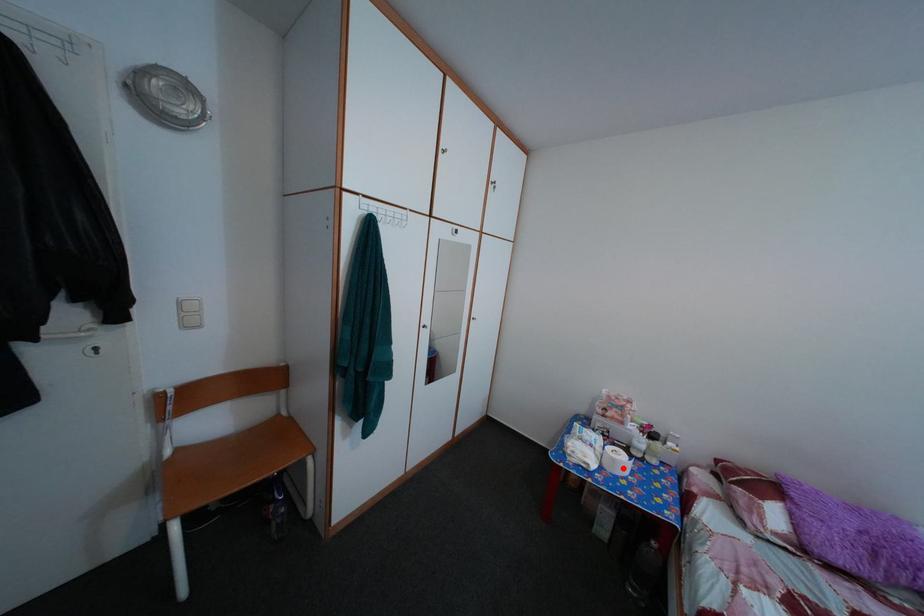
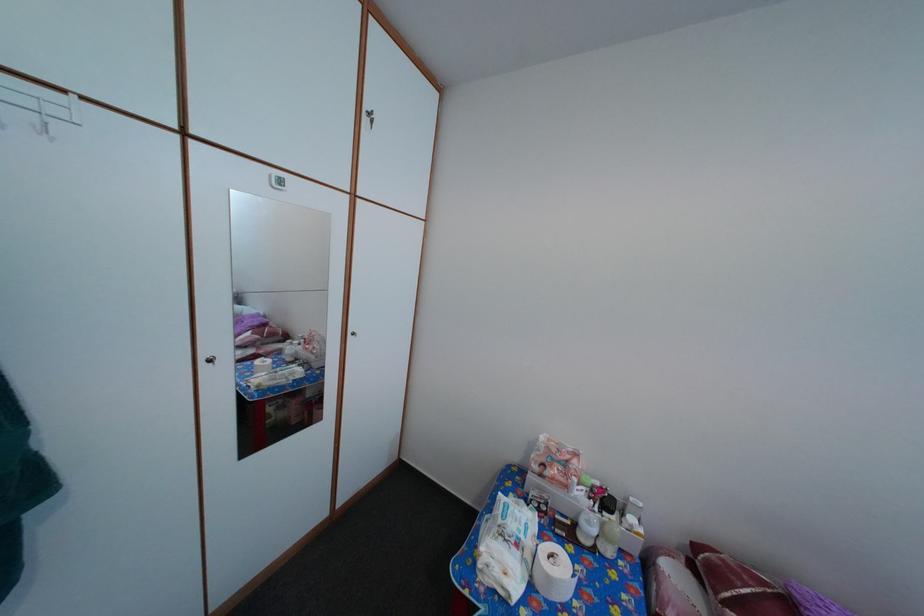
Question: A red point is marked in image1. In image2, is the corresponding 3D point closer to the camera or farther? Reply with the corresponding letter.

Choices:
 (A) The corresponding 3D point is closer.
 (B) The corresponding 3D point is farther.

Answer: (B)